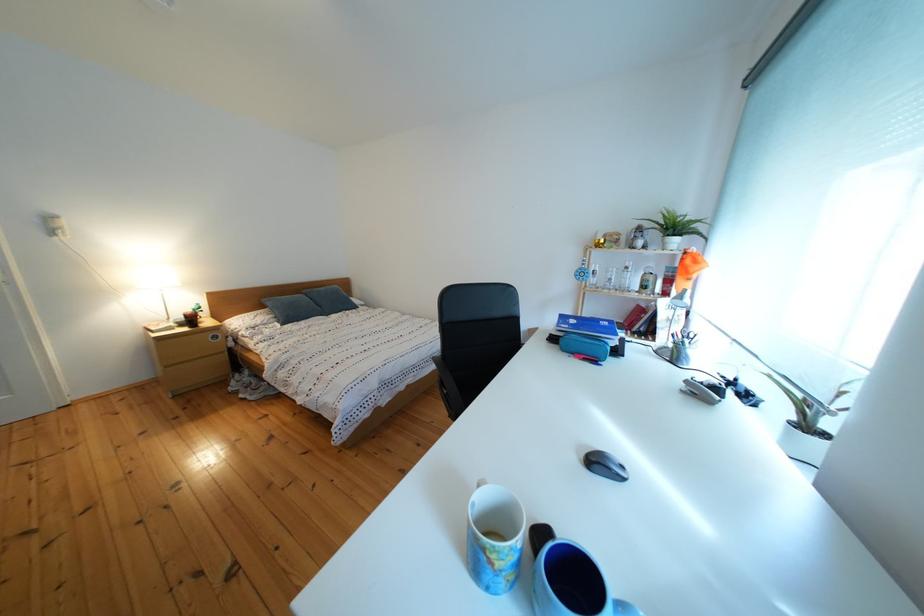
The height and width of the screenshot is (616, 924). What are the coordinates of `orange fabric pouch` in the screenshot? It's located at (688, 269).